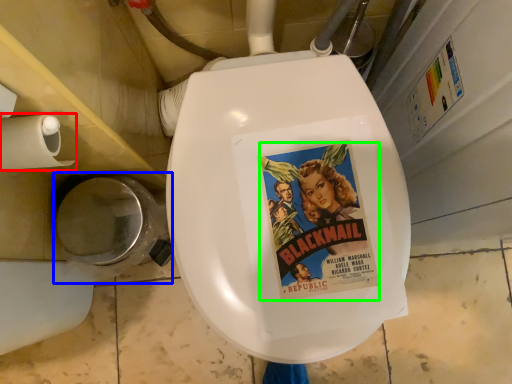
Question: Which object is positioned farthest from toilet paper (highlighted by a red box)? Select from toilet bowl (highlighted by a blue box) and comic book character (highlighted by a green box).

Choices:
 (A) toilet bowl
 (B) comic book character

Answer: (B)